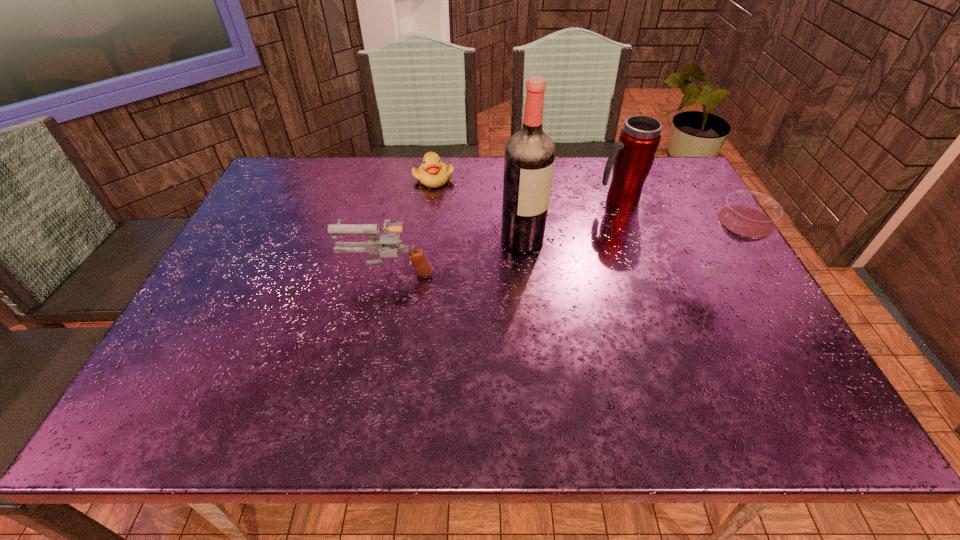
Identify the location of the second shortest object. (375, 246).

Where is `the rightmost object`? This screenshot has height=540, width=960. the rightmost object is located at coordinates (747, 216).

Find the location of a particular element. This screenshot has height=540, width=960. the third shortest object is located at coordinates (747, 216).

The width and height of the screenshot is (960, 540). Find the location of `the farthest object`. the farthest object is located at coordinates (432, 173).

The image size is (960, 540). Identify the location of duckling. (432, 173).

Locate an element on the screen. The height and width of the screenshot is (540, 960). liquor is located at coordinates (529, 159).

Image resolution: width=960 pixels, height=540 pixels. I want to click on the tallest object, so click(529, 159).

The height and width of the screenshot is (540, 960). Find the location of `the fourth shortest object`. the fourth shortest object is located at coordinates (632, 156).

The image size is (960, 540). I want to click on the second farthest object, so click(x=632, y=156).

At what (x,y) coordinates should I click in order to perform the action: click on blank space located at the barrel end of the fourth tallest object. Please return your answer as a coordinate pair (x, y). Looking at the image, I should click on (246, 269).